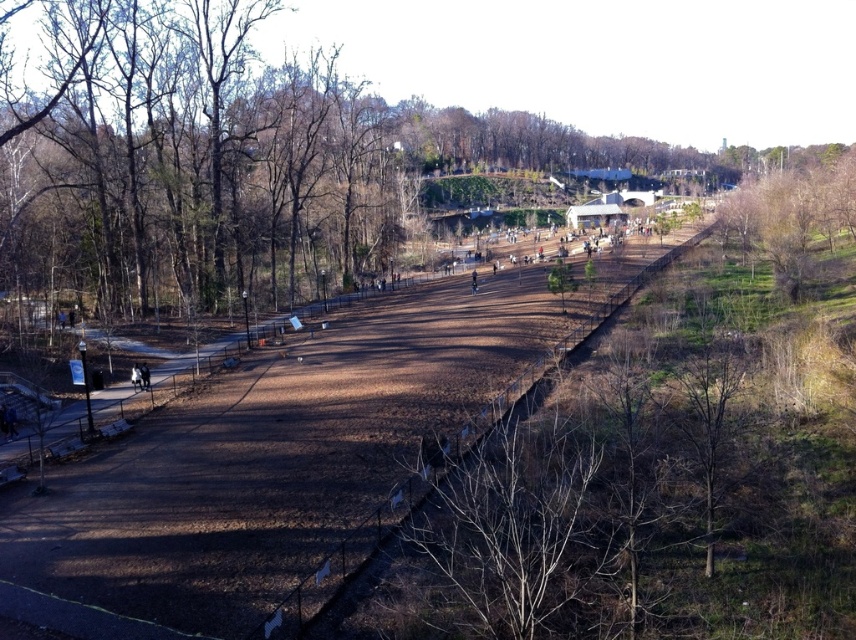
Question: From the image, what is the correct spatial relationship of brown dirt track at center in relation to bare wood tree at right?

Choices:
 (A) above
 (B) below

Answer: (B)

Question: Which of the following is the closest to the observer?

Choices:
 (A) (753, 227)
 (B) (116, 493)

Answer: (B)

Question: Which of these objects is positioned closest to the brown dirt track at center?

Choices:
 (A) bare wood tree at right
 (B) bare wood trees at upper left

Answer: (B)

Question: Among these objects, which one is farthest from the camera?

Choices:
 (A) bare wood trees at upper left
 (B) brown dirt track at center

Answer: (A)

Question: Does bare wood trees at upper left have a lesser width compared to brown dirt track at center?

Choices:
 (A) no
 (B) yes

Answer: (A)

Question: Observing the image, what is the correct spatial positioning of bare wood trees at upper left in reference to bare wood tree at right?

Choices:
 (A) below
 (B) above

Answer: (B)